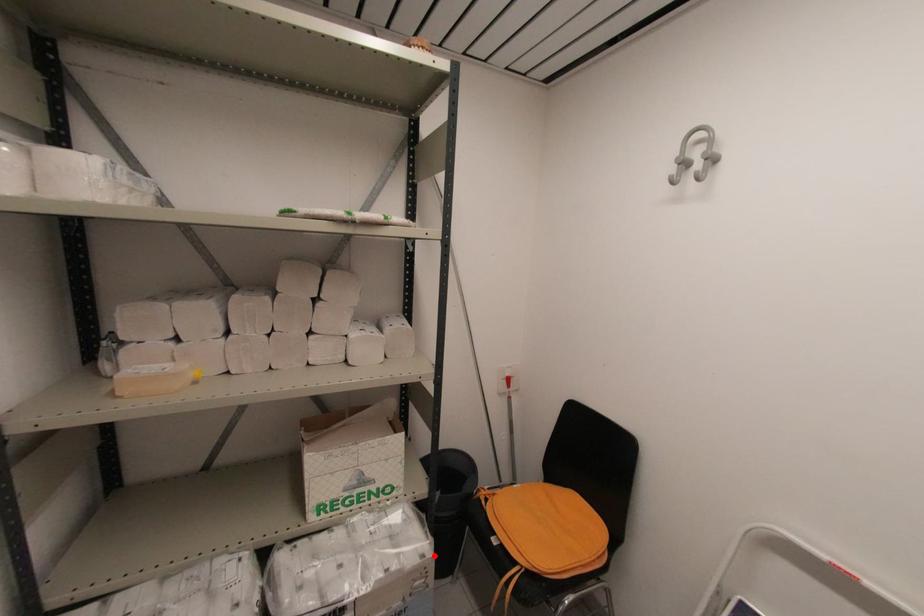
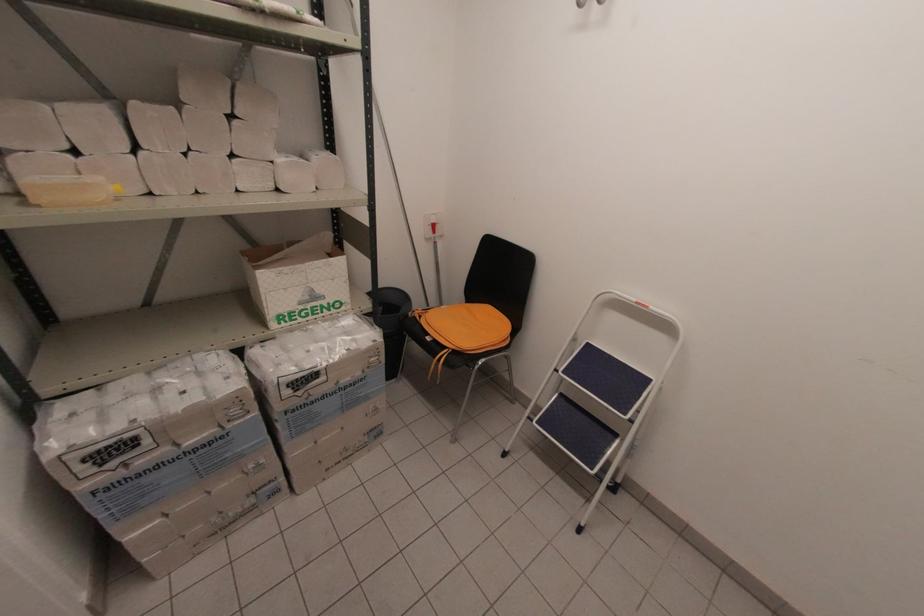
In the second image, find the point that corresponds to the highlighted location in the first image.

(383, 341)